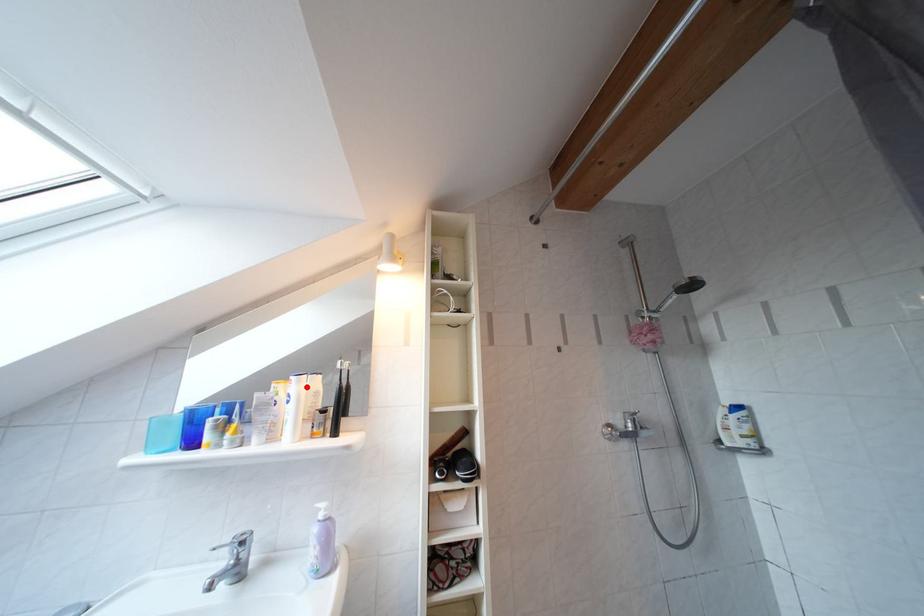
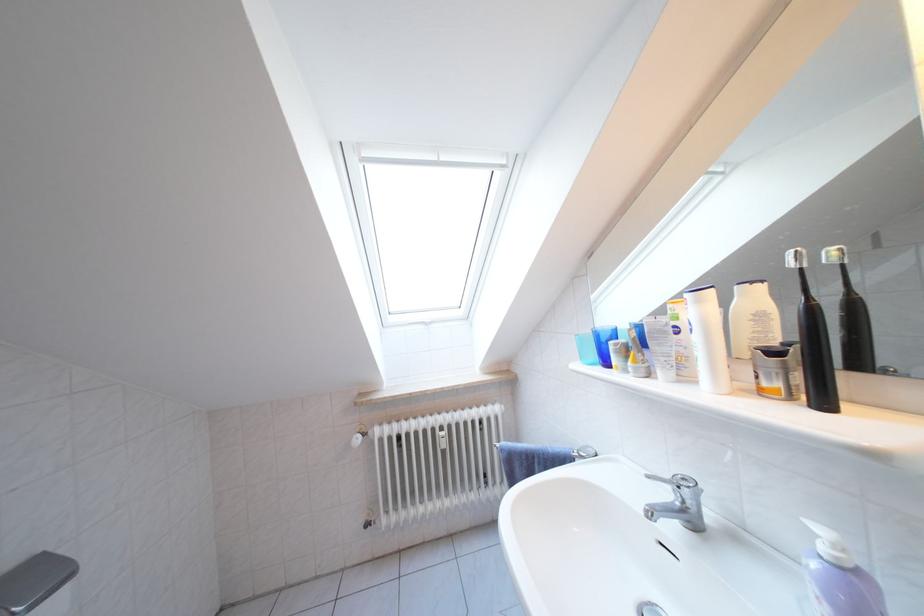
Where in the second image is the point corresponding to the highlighted location from the first image?

(708, 306)